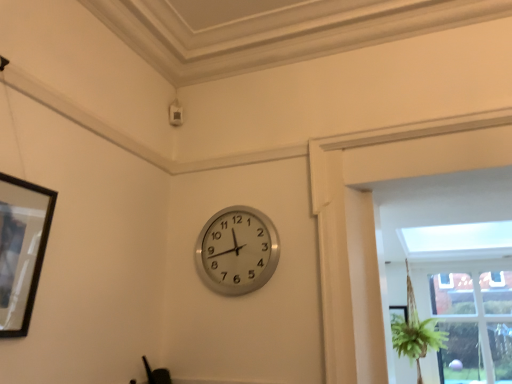
Question: Is black matte picture frame at left wider or thinner than clear glass window at center right?

Choices:
 (A) thin
 (B) wide

Answer: (A)

Question: Is black matte picture frame at left in front of or behind clear glass window at center right in the image?

Choices:
 (A) front
 (B) behind

Answer: (A)

Question: Which of these objects is positioned farthest from the clear glass window at center right?

Choices:
 (A) black matte picture frame at left
 (B) silver metallic clock at center

Answer: (A)

Question: Estimate the real-world distances between objects in this image. Which object is closer to the clear glass window at center right?

Choices:
 (A) black matte picture frame at left
 (B) silver metallic clock at center

Answer: (B)